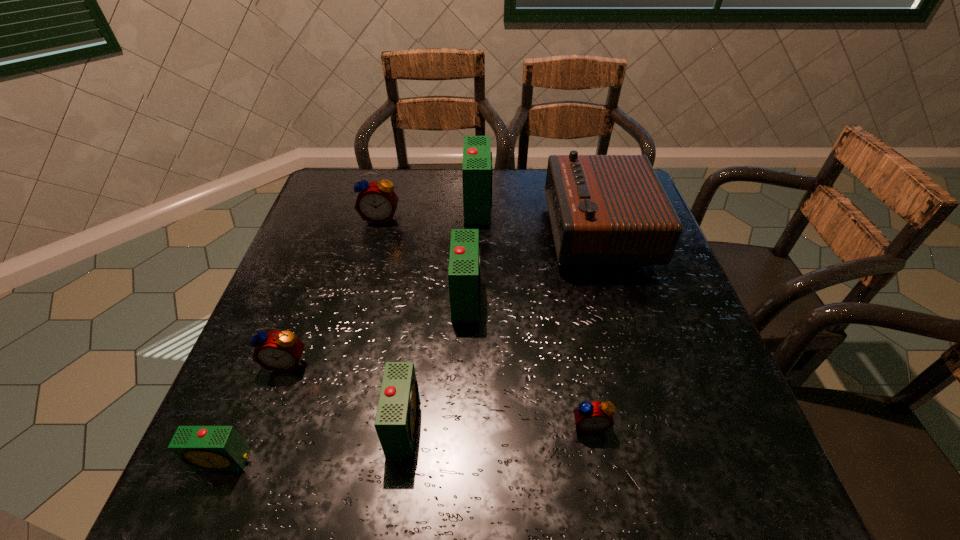
The image size is (960, 540). Identify the location of the fourth alarm clock from right to left. (396, 421).

Identify the location of the rightmost alarm clock. (591, 417).

Locate an element on the screen. The width and height of the screenshot is (960, 540). the nearest red alarm clock is located at coordinates (591, 417).

Find the location of `the smallest green alarm clock`. the smallest green alarm clock is located at coordinates (202, 448).

I want to click on free point located on the front-facing side of the biggest green alarm clock, so click(x=554, y=205).

Find the location of `free space located 0.200m on the front panel of the brown radio receiver`. free space located 0.200m on the front panel of the brown radio receiver is located at coordinates (474, 232).

The height and width of the screenshot is (540, 960). I want to click on vacant region located on the front panel of the brown radio receiver, so click(470, 232).

Locate an element on the screen. This screenshot has height=540, width=960. vacant space positioned on the front panel of the brown radio receiver is located at coordinates (512, 232).

Where is `vacant area situated on the front-facing side of the third object from left to right`? This screenshot has width=960, height=540. vacant area situated on the front-facing side of the third object from left to right is located at coordinates (375, 239).

At what (x,y) coordinates should I click in order to perform the action: click on free spot located 0.360m on the front-facing side of the second farthest green alarm clock. Please return your answer as a coordinate pair (x, y). Looking at the image, I should click on (637, 296).